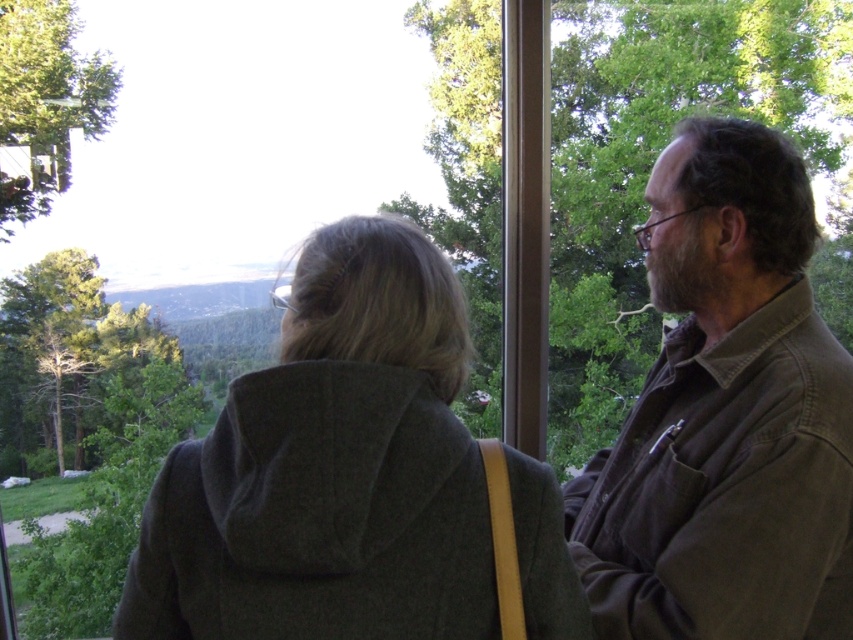
Is dark gray wool hoodie at center shorter than brown cotton shirt at right?

Yes, dark gray wool hoodie at center is shorter than brown cotton shirt at right.

Which is behind, point (469, 461) or point (680, 294)?

Point (680, 294)

Identify the location of dark gray wool hoodie at center. Image resolution: width=853 pixels, height=640 pixels. (331, 468).